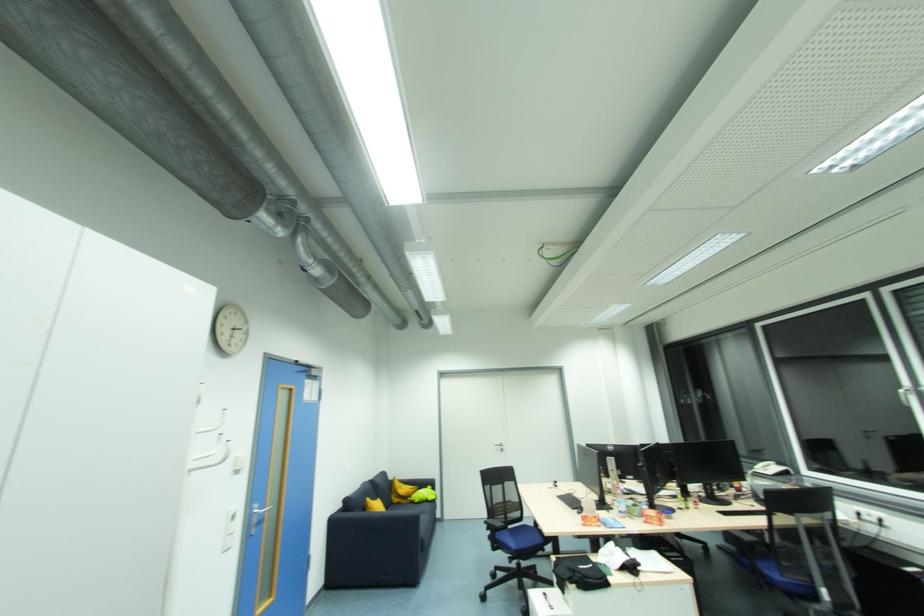
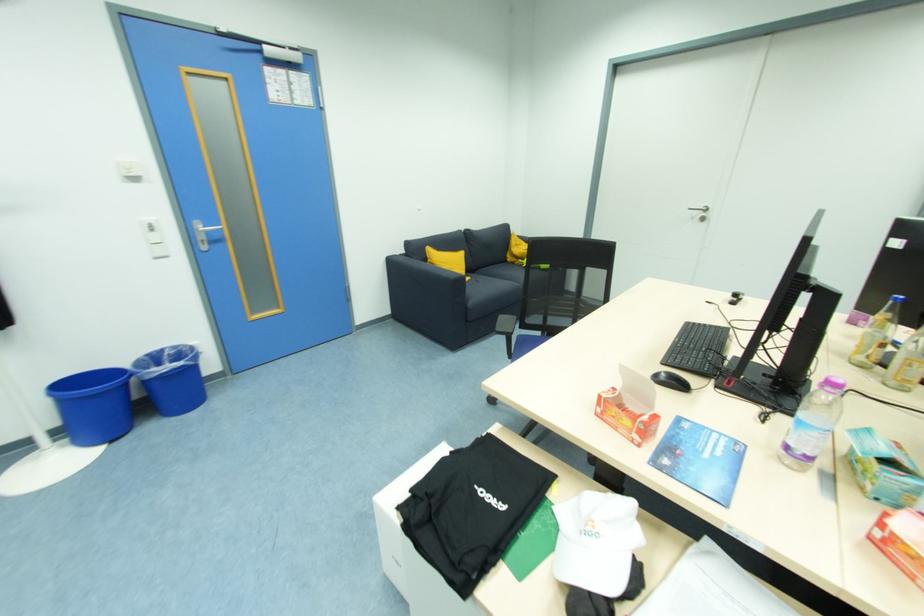
Find the pixel in the second image that matches [505,451] in the first image.

(706, 221)